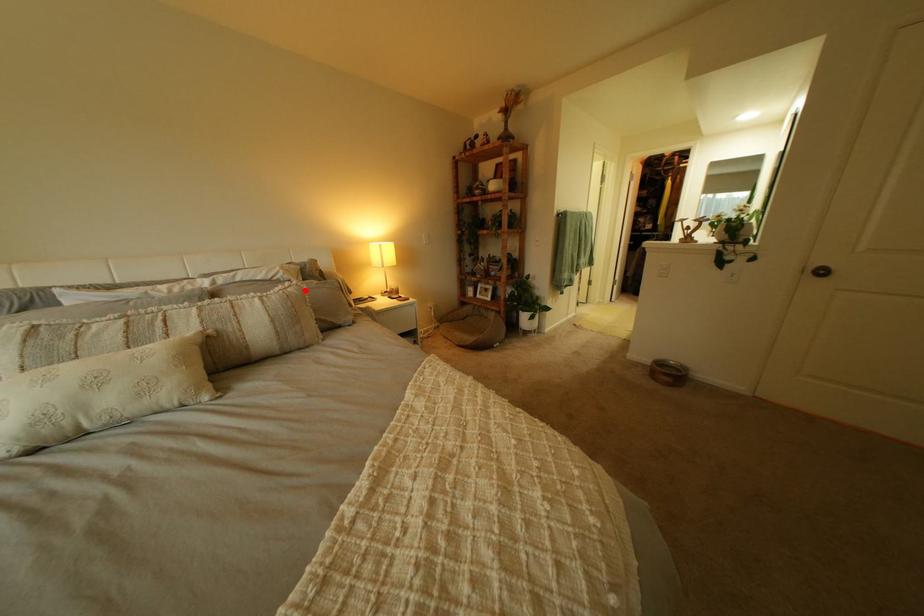
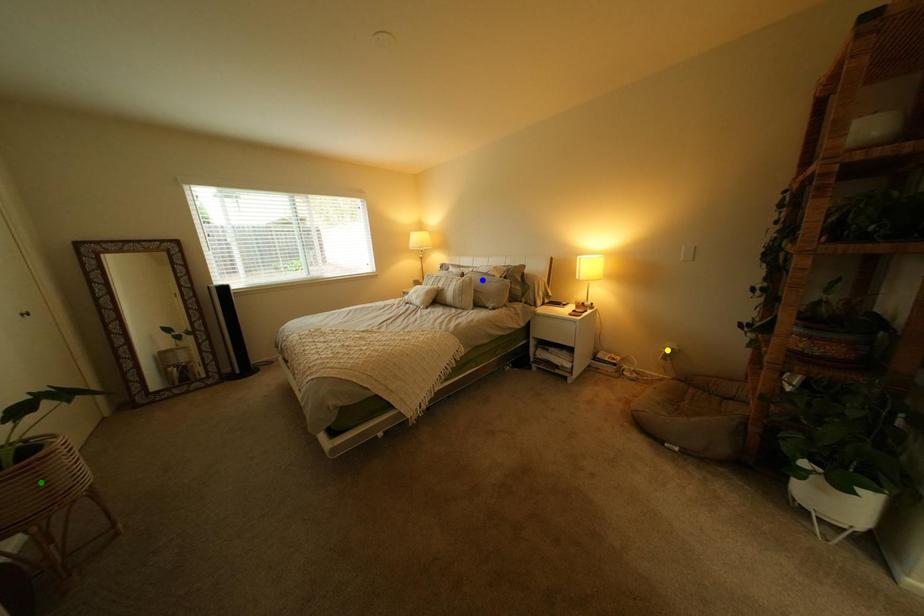
Question: I am providing you with two images of the same scene from different viewpoints. A red point is marked on the first image. You are given multiple points on the second image. Which point in image 2 is actually the same real-world point as the red point in image 1?

Choices:
 (A) blue point
 (B) green point
 (C) yellow point

Answer: (A)